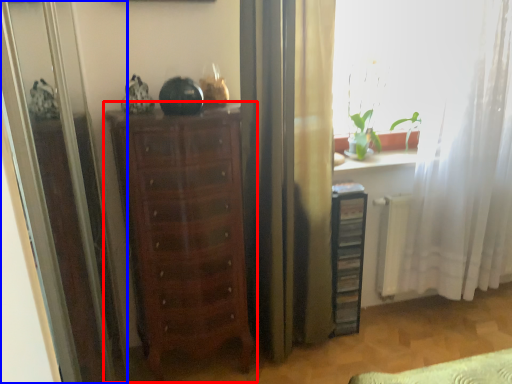
Question: Which object appears closest to the camera in this image, chest of drawers (highlighted by a red box) or screen door (highlighted by a blue box)?

Choices:
 (A) chest of drawers
 (B) screen door

Answer: (B)